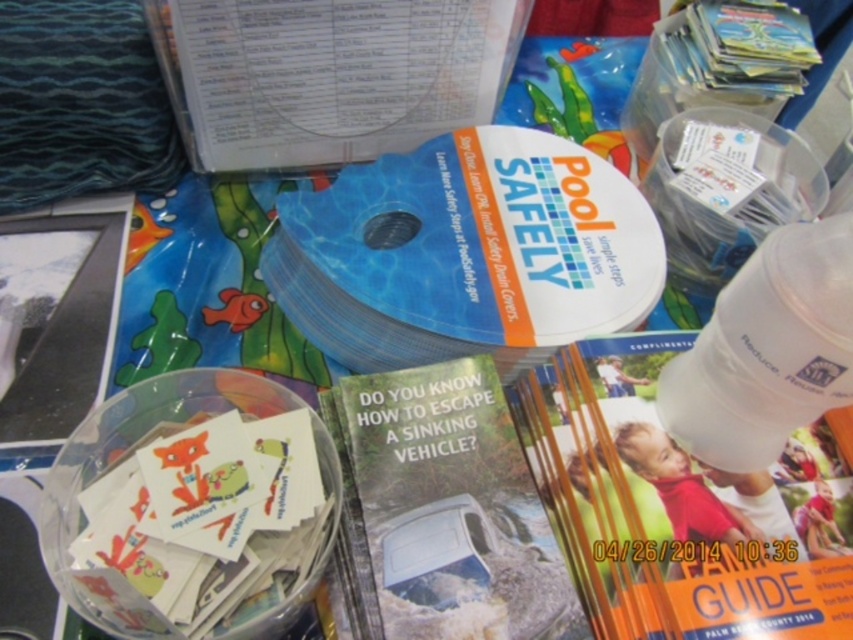
Question: Which object is farther from the camera taking this photo?

Choices:
 (A) white translucent bottle at center-right
 (B) green glossy brochure at center
 (C) matte paper guide at center

Answer: (C)

Question: Is matte paper guide at center in front of white glossy magazine at upper center?

Choices:
 (A) no
 (B) yes

Answer: (B)

Question: Does matte paper guide at center have a lesser width compared to white glossy magazine at upper center?

Choices:
 (A) no
 (B) yes

Answer: (B)

Question: Where is green glossy brochure at center located in relation to white translucent bottle at center-right in the image?

Choices:
 (A) right
 (B) left

Answer: (B)

Question: Which object is positioned farthest from the white glossy magazine at upper center?

Choices:
 (A) green glossy brochure at center
 (B) white translucent bottle at center-right
 (C) matte paper guide at center

Answer: (B)

Question: Which object is farther from the camera taking this photo?

Choices:
 (A) matte paper guide at center
 (B) white translucent bottle at center-right
 (C) white glossy magazine at upper center
 (D) green glossy brochure at center

Answer: (C)